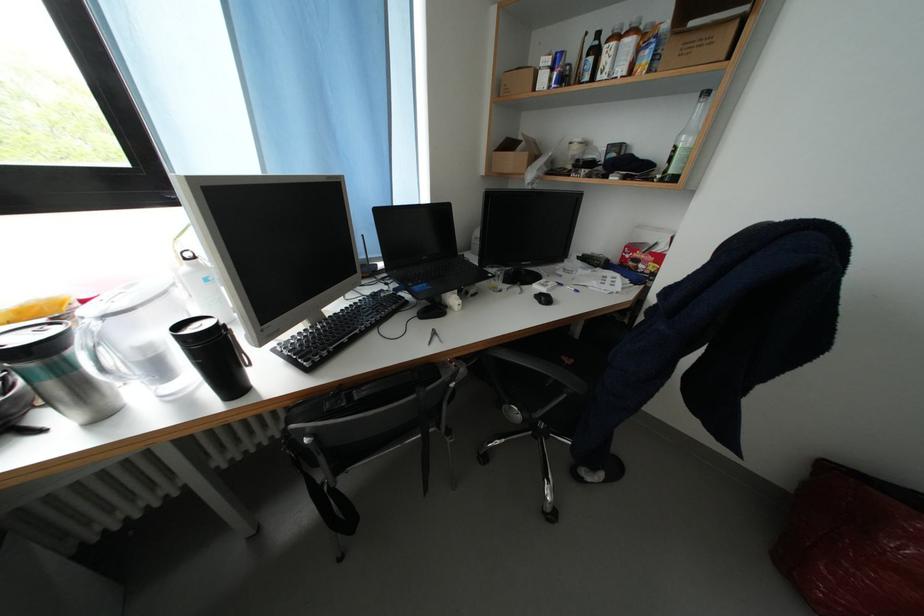
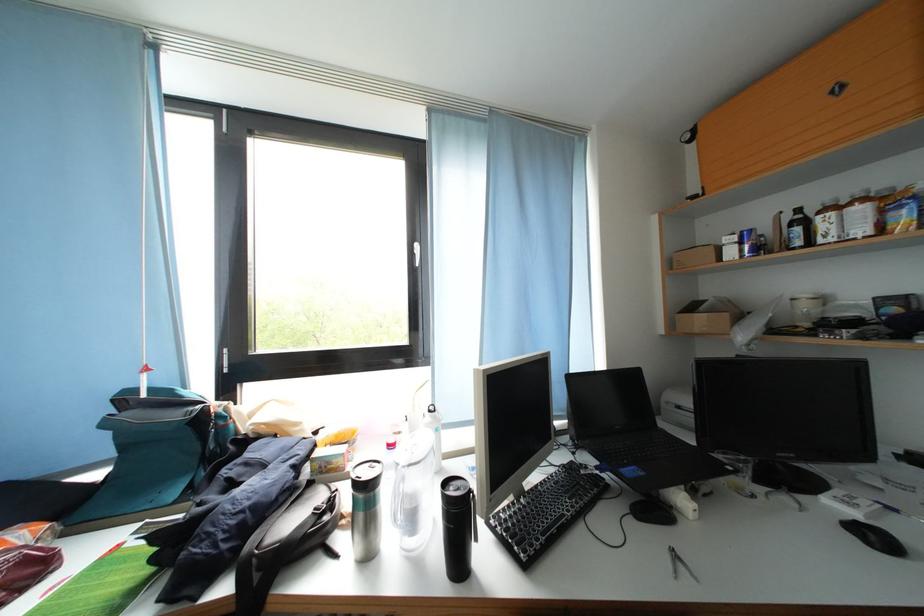
Locate, in the second image, the point that corresponds to pixel 517 151 in the first image.

(700, 312)